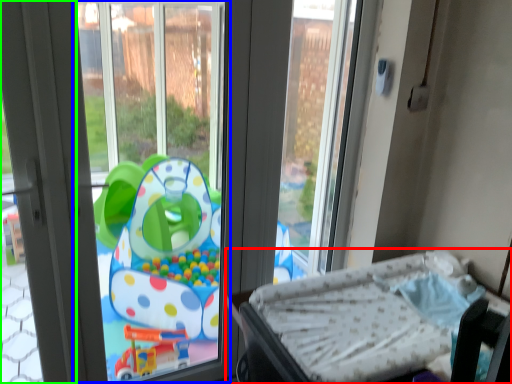
Question: Which object is positioned closest to furniture (highlighted by a red box)? Select from window screen (highlighted by a blue box) and screen door (highlighted by a green box).

Choices:
 (A) window screen
 (B) screen door

Answer: (B)